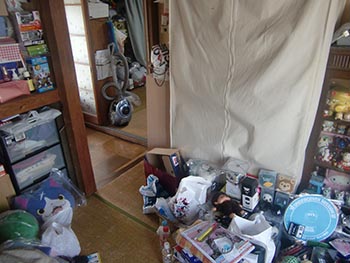
Image resolution: width=350 pixels, height=263 pixels. I want to click on booklet, so click(226, 249).